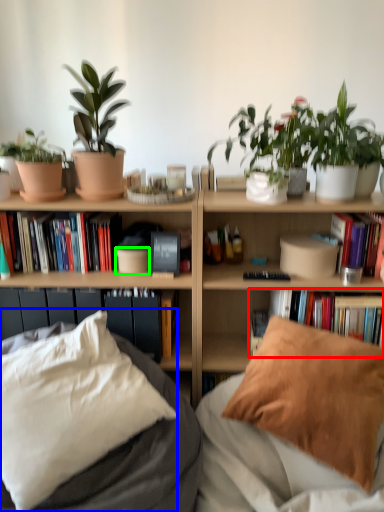
Question: Based on their relative distances, which object is nearer to book (highlighted by a red box)? Choose from pillow (highlighted by a blue box) and flowerpot (highlighted by a green box).

Choices:
 (A) pillow
 (B) flowerpot

Answer: (B)